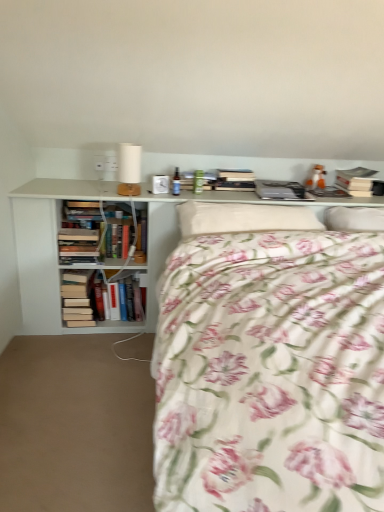
Where is `vacant area that is in front of hardcover book at upper right, the third book viewed from the left`? This screenshot has width=384, height=512. vacant area that is in front of hardcover book at upper right, the third book viewed from the left is located at coordinates (364, 195).